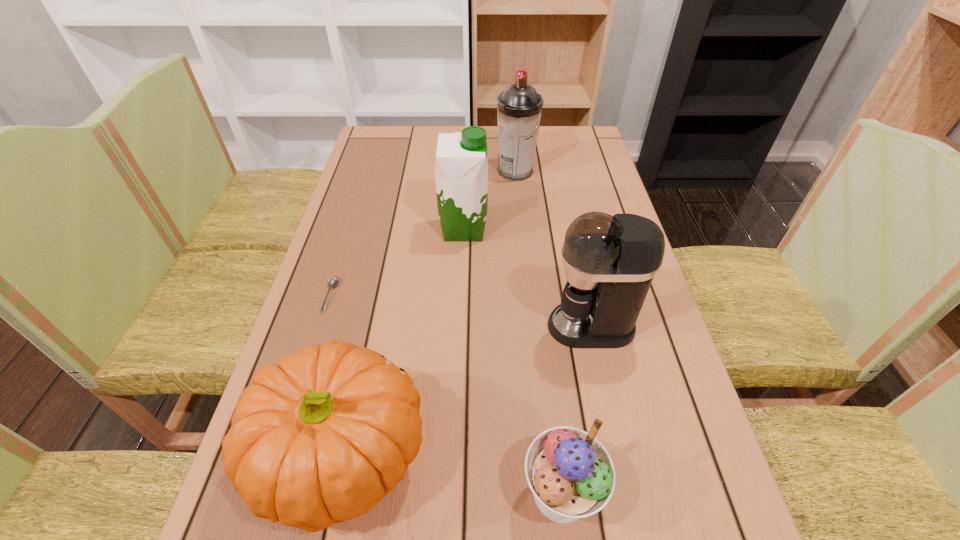
I want to click on empty location between the icecream and the farthest object, so click(539, 332).

Locate an element on the screen. The image size is (960, 540). free space between the soupspoon and the soya milk is located at coordinates (397, 262).

This screenshot has width=960, height=540. I want to click on free area in between the farthest object and the soupspoon, so click(x=423, y=234).

What are the coordinates of `unoccupied position between the soupspoon and the farthest object` in the screenshot? It's located at (423, 234).

Where is `free space that is in between the farthest object and the second farthest object`? Image resolution: width=960 pixels, height=540 pixels. free space that is in between the farthest object and the second farthest object is located at coordinates (490, 200).

I want to click on free space between the soya milk and the icecream, so click(513, 361).

At what (x,y) coordinates should I click in order to perform the action: click on free space between the coffee maker and the soya milk. Please return your answer as a coordinate pair (x, y). This screenshot has height=540, width=960. Looking at the image, I should click on (527, 278).

Select which object is the closest to the pumpkin. Please provide its 2D coordinates. Your answer should be formatted as a tuple, i.e. [(x, y)], where the tuple contains the x and y coordinates of a point satisfying the conditions above.

[(570, 473)]

Locate which object ranks fifth in proximity to the icecream. Please provide its 2D coordinates. Your answer should be formatted as a tuple, i.e. [(x, y)], where the tuple contains the x and y coordinates of a point satisfying the conditions above.

[(519, 107)]

Where is `vacant position in the image that satisfies the following two spatial constraints: 1. on the front-facing side of the soya milk; 2. on the back side of the fifth tallest object`? The width and height of the screenshot is (960, 540). vacant position in the image that satisfies the following two spatial constraints: 1. on the front-facing side of the soya milk; 2. on the back side of the fifth tallest object is located at coordinates (453, 493).